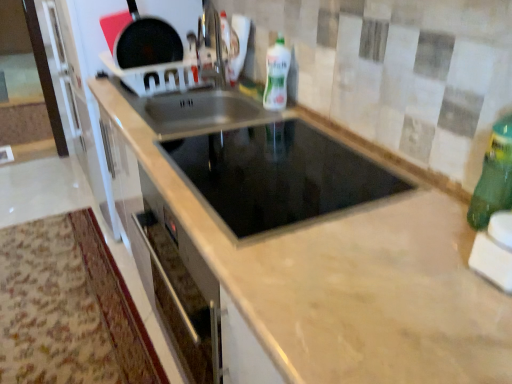
Question: Is white glossy bottle at upper center, the first bottle from the top, touching green plastic bottle at right, which is the first bottle from bottom to top?

Choices:
 (A) no
 (B) yes

Answer: (A)

Question: Is white glossy bottle at upper center, the first bottle from the top, further to the viewer compared to green plastic bottle at right, which ranks as the second bottle in top-to-bottom order?

Choices:
 (A) no
 (B) yes

Answer: (B)

Question: Would you say white glossy bottle at upper center, the second bottle ordered from the bottom, is outside green plastic bottle at right, which ranks as the second bottle in top-to-bottom order?

Choices:
 (A) yes
 (B) no

Answer: (A)

Question: Considering the relative sizes of white glossy bottle at upper center, arranged as the 2th bottle when viewed from the front, and green plastic bottle at right, which ranks as the second bottle in top-to-bottom order, in the image provided, is white glossy bottle at upper center, arranged as the 2th bottle when viewed from the front, shorter than green plastic bottle at right, which ranks as the second bottle in top-to-bottom order,?

Choices:
 (A) no
 (B) yes

Answer: (B)

Question: Is white glossy bottle at upper center, the second bottle ordered from the bottom, at the right side of green plastic bottle at right, which appears as the 2th bottle when viewed from the left?

Choices:
 (A) no
 (B) yes

Answer: (A)

Question: Considering the positions of white glossy bottle at upper center, which is counted as the first bottle, starting from the left, and green plastic bottle at right, which appears as the 2th bottle when viewed from the left, in the image, is white glossy bottle at upper center, which is counted as the first bottle, starting from the left, wider or thinner than green plastic bottle at right, which appears as the 2th bottle when viewed from the left,?

Choices:
 (A) thin
 (B) wide

Answer: (B)

Question: In the image, is white glossy bottle at upper center, which is counted as the first bottle, starting from the left, positioned in front of or behind green plastic bottle at right, placed as the 1th bottle when sorted from right to left?

Choices:
 (A) behind
 (B) front

Answer: (A)

Question: Looking at the image, does white glossy bottle at upper center, the first bottle from the top, seem bigger or smaller compared to green plastic bottle at right, which ranks as the second bottle in top-to-bottom order?

Choices:
 (A) big
 (B) small

Answer: (A)

Question: Visually, is white glossy bottle at upper center, which is counted as the first bottle, starting from the left, positioned to the left or to the right of green plastic bottle at right, which is the first bottle from bottom to top?

Choices:
 (A) left
 (B) right

Answer: (A)

Question: Is point (146, 41) positioned closer to the camera than point (495, 198)?

Choices:
 (A) closer
 (B) farther

Answer: (B)

Question: Considering the positions of shiny black frying pan at upper left and green plastic bottle at right, placed as the 1th bottle when sorted from right to left, in the image, is shiny black frying pan at upper left taller or shorter than green plastic bottle at right, placed as the 1th bottle when sorted from right to left,?

Choices:
 (A) tall
 (B) short

Answer: (A)

Question: Considering the positions of shiny black frying pan at upper left and green plastic bottle at right, which appears as the 2th bottle when viewed from the left, in the image, is shiny black frying pan at upper left wider or thinner than green plastic bottle at right, which appears as the 2th bottle when viewed from the left,?

Choices:
 (A) thin
 (B) wide

Answer: (B)

Question: Looking at the image, does shiny black frying pan at upper left seem bigger or smaller compared to green plastic bottle at right, which appears as the 2th bottle when viewed from the left?

Choices:
 (A) big
 (B) small

Answer: (A)

Question: From a real-world perspective, is black glass cooktop at center above or below white glossy bottle at upper center, the 2th bottle from the right?

Choices:
 (A) above
 (B) below

Answer: (B)

Question: From their relative heights in the image, would you say black glass cooktop at center is taller or shorter than white glossy bottle at upper center, which is counted as the first bottle, starting from the left?

Choices:
 (A) tall
 (B) short

Answer: (B)